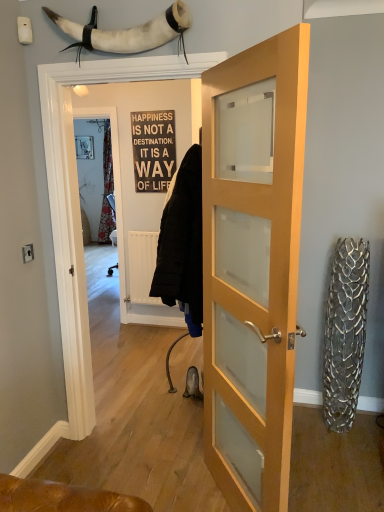
Question: Should I look upward or downward to see light wood/glass door at center, acting as the 2th door starting from the left?

Choices:
 (A) up
 (B) down

Answer: (B)

Question: Can you confirm if light wood/glass door at center, acting as the first door starting from the right, is bigger than white wood sign at center?

Choices:
 (A) yes
 (B) no

Answer: (A)

Question: Considering the relative sizes of light wood/glass door at center, acting as the first door starting from the right, and white wood sign at center in the image provided, is light wood/glass door at center, acting as the first door starting from the right, wider than white wood sign at center?

Choices:
 (A) no
 (B) yes

Answer: (B)

Question: Is light wood/glass door at center, acting as the 2th door starting from the left, behind white wood sign at center?

Choices:
 (A) no
 (B) yes

Answer: (A)

Question: Can you confirm if light wood/glass door at center, acting as the first door starting from the right, is positioned to the left of white wood sign at center?

Choices:
 (A) yes
 (B) no

Answer: (B)

Question: Considering the relative sizes of light wood/glass door at center, acting as the 2th door starting from the left, and white wood sign at center in the image provided, is light wood/glass door at center, acting as the 2th door starting from the left, taller than white wood sign at center?

Choices:
 (A) yes
 (B) no

Answer: (A)

Question: Can you confirm if light wood/glass door at center, acting as the first door starting from the right, is positioned to the right of white wood sign at center?

Choices:
 (A) no
 (B) yes

Answer: (B)

Question: Is wooden door at center, acting as the 2th door starting from the right, facing away from white leather horn at upper center?

Choices:
 (A) no
 (B) yes

Answer: (A)

Question: Is wooden door at center, arranged as the 1th door when viewed from the left, not near white leather horn at upper center?

Choices:
 (A) no
 (B) yes

Answer: (B)

Question: Is wooden door at center, arranged as the 1th door when viewed from the left, directly adjacent to white leather horn at upper center?

Choices:
 (A) no
 (B) yes

Answer: (A)

Question: Is wooden door at center, acting as the 2th door starting from the right, aimed at white leather horn at upper center?

Choices:
 (A) yes
 (B) no

Answer: (B)

Question: Can we say wooden door at center, acting as the 2th door starting from the right, lies outside white leather horn at upper center?

Choices:
 (A) no
 (B) yes

Answer: (B)

Question: Considering the relative sizes of wooden door at center, arranged as the 1th door when viewed from the left, and white leather horn at upper center in the image provided, is wooden door at center, arranged as the 1th door when viewed from the left, smaller than white leather horn at upper center?

Choices:
 (A) yes
 (B) no

Answer: (B)

Question: Is white leather horn at upper center located outside wooden door at center, acting as the 2th door starting from the right?

Choices:
 (A) yes
 (B) no

Answer: (A)